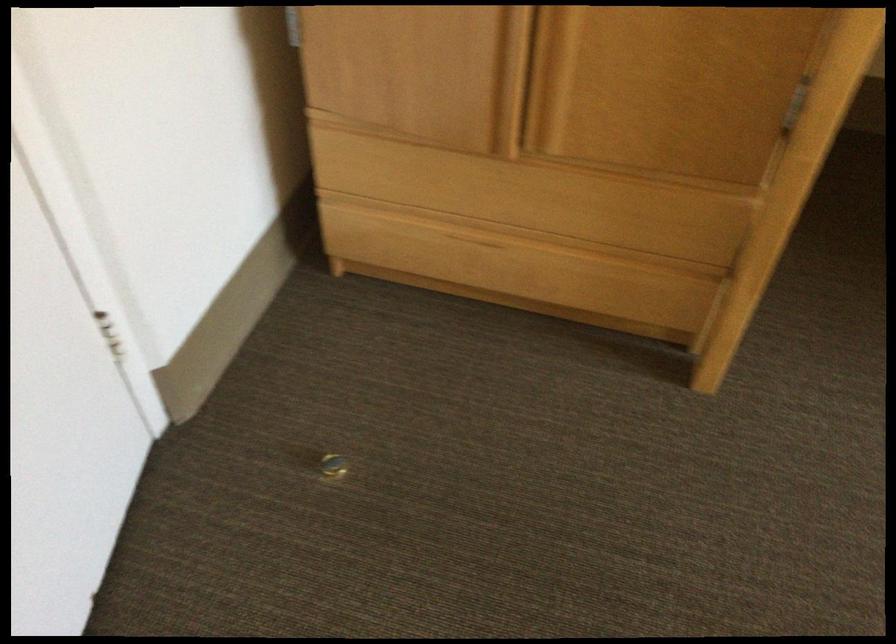
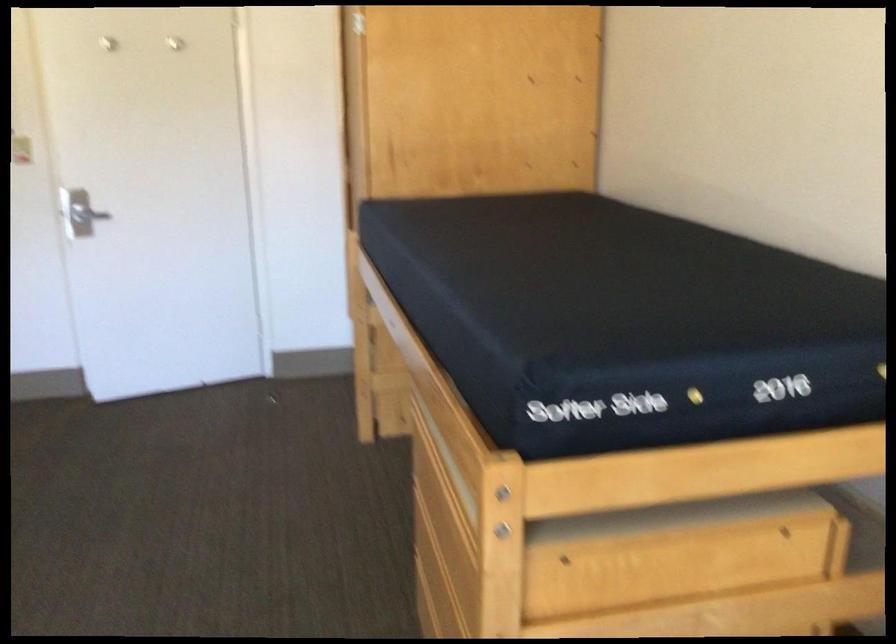
Question: I am providing you with two images of the same scene from different viewpoints. Which of the following objects are not visible in image2?

Choices:
 (A) light switch
 (B) top drawer handle
 (C) metal holder cover
 (D) wooden drawer

Answer: (B)